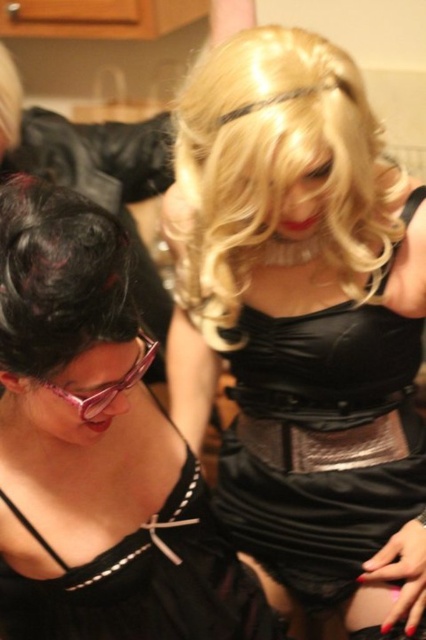
You are a fashion designer observing the image. You need to determine the spatial arrangement of the black satin dress at center and the pink plastic goggles at lower left. Which object is positioned higher in the image?

The pink plastic goggles at lower left are positioned higher than the black satin dress at center.

You are a fashion designer measuring the space between two black satin dresses displayed in the center of the image. The first is labeled as the satin black dress at center, and the second is labeled as the black satin dress at center. Can you confirm if there is enough space between them to fit a 10.05 inch wide mannequin?

The distance between the satin black dress at center and the black satin dress at center is exactly 10.05 inches, so the mannequin of the same width can fit between them.